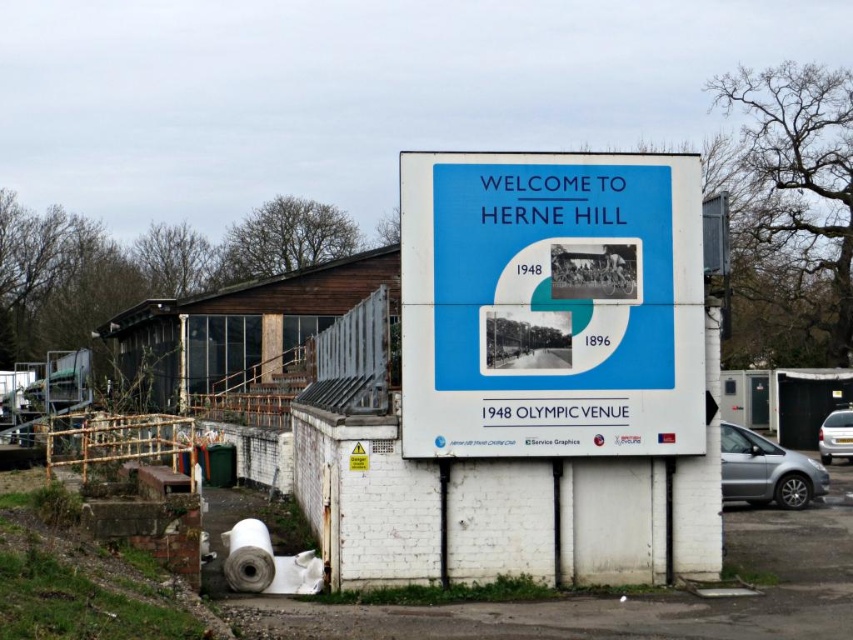
Can you confirm if silver metallic car at lower right is taller than silver metallic car at right?

No, silver metallic car at lower right is not taller than silver metallic car at right.

Between silver metallic car at lower right and silver metallic car at right, which one has less height?

silver metallic car at lower right

Find the location of a particular element. This screenshot has height=640, width=853. silver metallic car at lower right is located at coordinates (767, 470).

Is point (619, 177) positioned behind point (740, 436)?

No, it is not.

This screenshot has height=640, width=853. In order to click on blue matte signboard at center in this screenshot , I will do pos(550,305).

Does blue matte signboard at center have a lesser width compared to silver metallic car at right?

No, blue matte signboard at center is not thinner than silver metallic car at right.

Which is behind, point (434, 264) or point (839, 420)?

Point (839, 420)

Does point (686, 260) come in front of point (831, 458)?

Yes, point (686, 260) is closer to viewer.

Where is `blue matte signboard at center`? Image resolution: width=853 pixels, height=640 pixels. blue matte signboard at center is located at coordinates (550, 305).